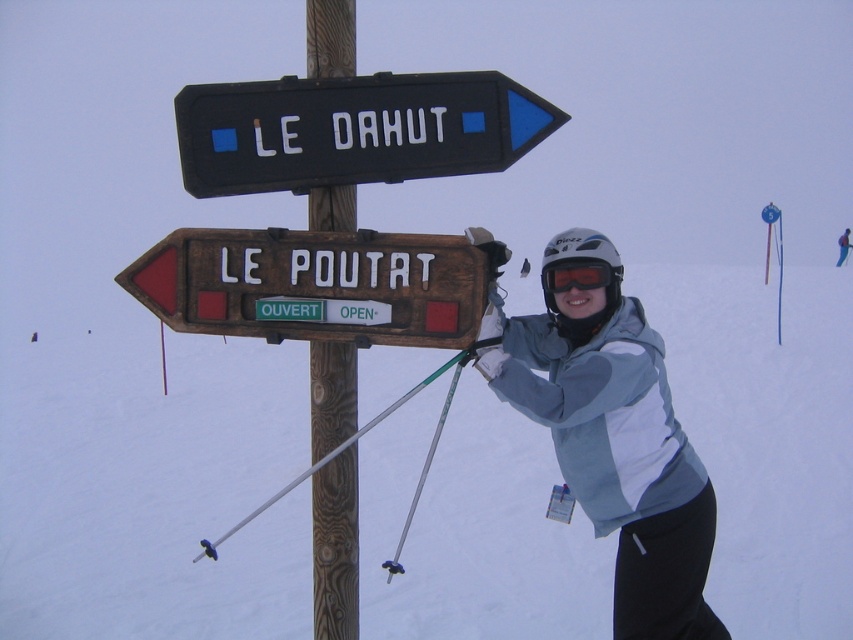
Question: Is black plastic sign at upper center further to the viewer compared to wooden signpost at upper center?

Choices:
 (A) yes
 (B) no

Answer: (B)

Question: Can you confirm if light blue fabric jacket at center is positioned to the left of white matte helmet at upper center?

Choices:
 (A) no
 (B) yes

Answer: (B)

Question: Does wooden signpost at upper center have a larger size compared to white matte helmet at upper center?

Choices:
 (A) no
 (B) yes

Answer: (A)

Question: Among these points, which one is farthest from the camera?

Choices:
 (A) (495, 168)
 (B) (460, 304)

Answer: (A)

Question: Which point is farther to the camera?

Choices:
 (A) orange reflective goggles at center
 (B) black plastic sign at upper center
 (C) wooden signpost at upper center

Answer: (A)

Question: Which is nearer to the light blue fabric jacket at center?

Choices:
 (A) orange reflective goggles at center
 (B) wooden signpost at upper center

Answer: (A)